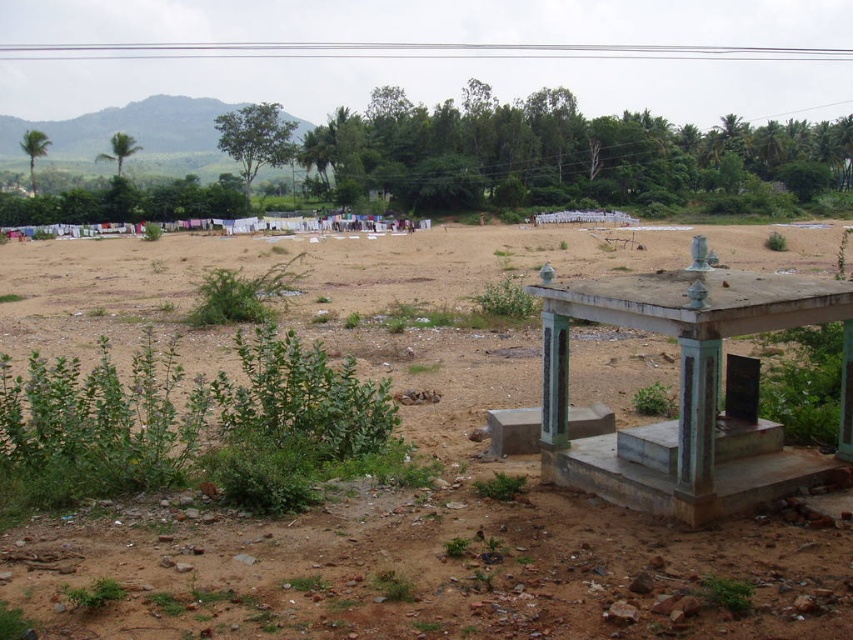
Question: Is the position of brown dirt field at center more distant than that of smooth concrete gazebo at center right?

Choices:
 (A) yes
 (B) no

Answer: (B)

Question: Among these points, which one is nearest to the camera?

Choices:
 (A) (699, 419)
 (B) (257, 582)

Answer: (B)

Question: Can you confirm if brown dirt field at center is positioned below smooth concrete gazebo at center right?

Choices:
 (A) yes
 (B) no

Answer: (B)

Question: Is brown dirt field at center positioned at the back of smooth concrete gazebo at center right?

Choices:
 (A) yes
 (B) no

Answer: (B)

Question: Among these objects, which one is farthest from the camera?

Choices:
 (A) smooth concrete gazebo at center right
 (B) brown dirt field at center

Answer: (A)